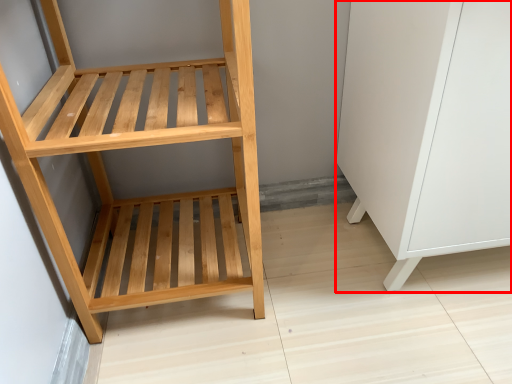
Question: From the image, what is the correct spatial relationship of file cabinet (annotated by the red box) in relation to furniture?

Choices:
 (A) right
 (B) left

Answer: (A)